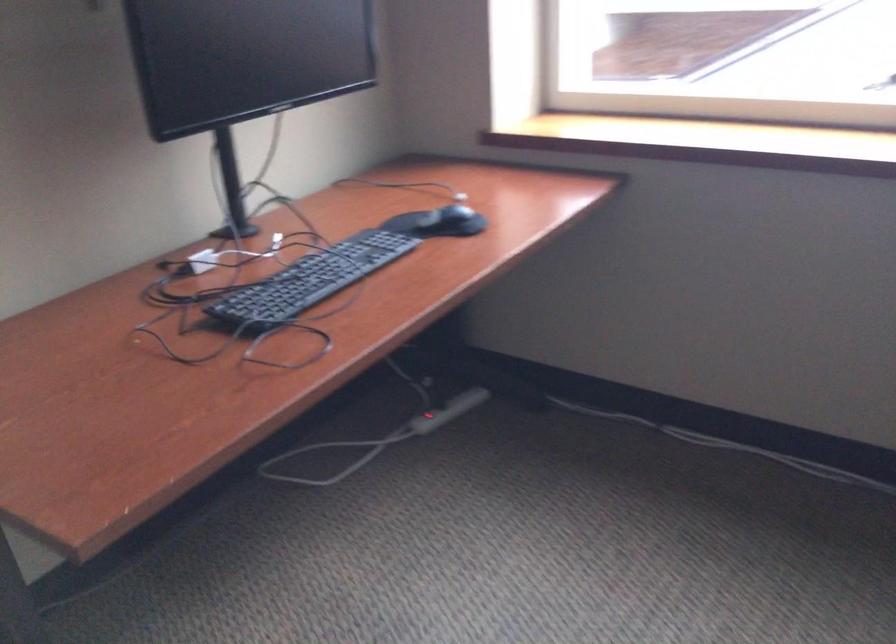
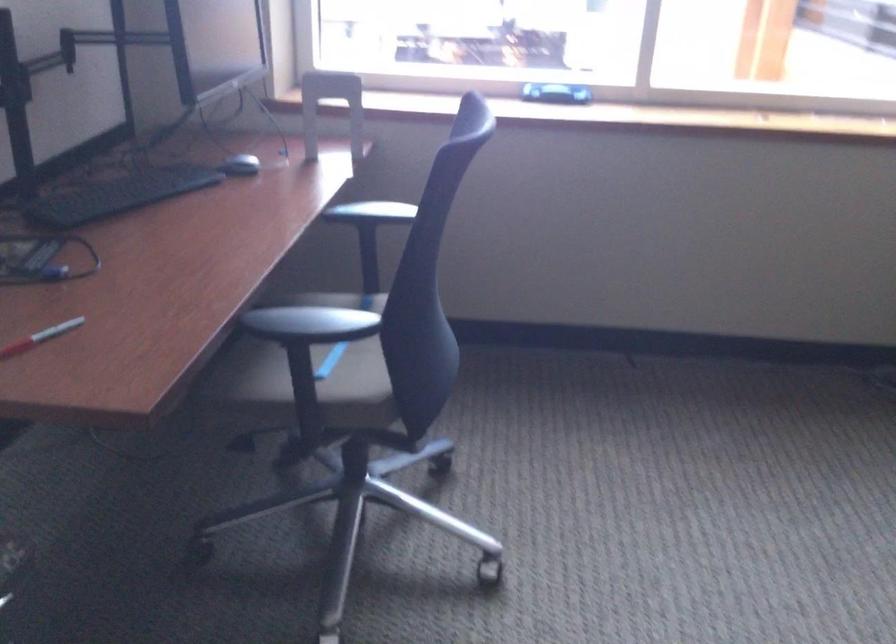
What movement of the cameraman would produce the second image?

The cameraman walked toward right, backward.